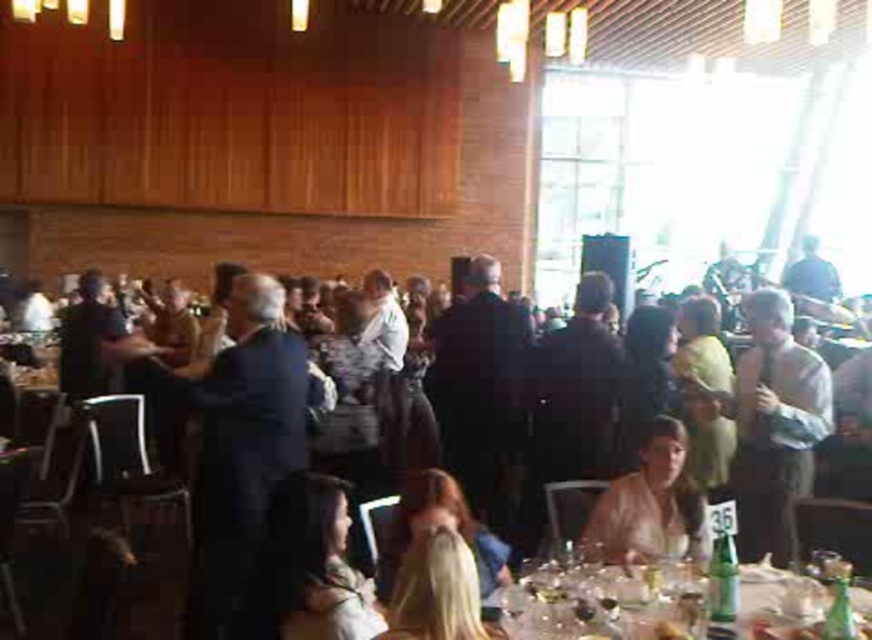
Measure the distance from translucent glassware at lower right to dark brown hair at lower center.

translucent glassware at lower right and dark brown hair at lower center are 25.53 inches apart from each other.

Which is in front, point (584, 618) or point (296, 620)?

Point (296, 620) is in front.

Does point (540, 602) lie in front of point (319, 582)?

No, (540, 602) is behind (319, 582).

In order to click on translucent glassware at lower right in this screenshot , I will do `click(603, 600)`.

Who is positioned more to the right, translucent glassware at lower right or light brown hair at lower center?

Positioned to the right is light brown hair at lower center.

Does translucent glassware at lower right appear on the left side of light brown hair at lower center?

Yes, translucent glassware at lower right is to the left of light brown hair at lower center.

I want to click on translucent glassware at lower right, so click(x=603, y=600).

Does dark brown hair at lower center have a smaller size compared to light brown hair at lower center?

Yes, dark brown hair at lower center is smaller than light brown hair at lower center.

Which of these two, dark brown hair at lower center or light brown hair at lower center, stands shorter?

Standing shorter between the two is dark brown hair at lower center.

Between point (331, 532) and point (693, 529), which one is positioned in front?

Point (331, 532)

Locate an element on the screen. dark brown hair at lower center is located at coordinates (314, 564).